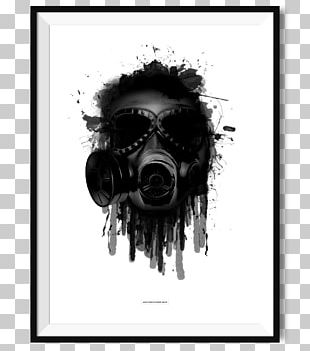
Locate an element on the screen. The height and width of the screenshot is (351, 310). thin black frame is located at coordinates (33, 320).